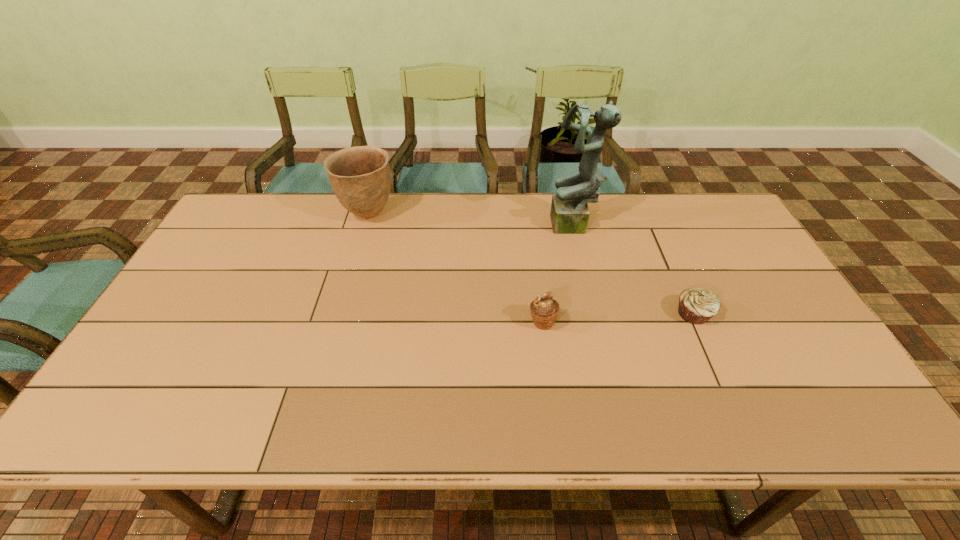
Locate an element on the screen. The width and height of the screenshot is (960, 540). free space between the shortest object and the left muffin is located at coordinates (618, 318).

Locate which object ranks second in proximity to the second object from left to right. Please provide its 2D coordinates. Your answer should be formatted as a tuple, i.e. [(x, y)], where the tuple contains the x and y coordinates of a point satisfying the conditions above.

[(696, 305)]

Locate which object ranks in proximity to the third object from left to right. Please provide its 2D coordinates. Your answer should be formatted as a tuple, i.e. [(x, y)], where the tuple contains the x and y coordinates of a point satisfying the conditions above.

[(696, 305)]

Locate an element on the screen. free space that satisfies the following two spatial constraints: 1. on the face of the shorter muffin; 2. on the left side of the sculpture is located at coordinates (594, 314).

The height and width of the screenshot is (540, 960). Find the location of `vacant space that satisfies the following two spatial constraints: 1. on the face of the sculpture; 2. on the front side of the second object from left to right`. vacant space that satisfies the following two spatial constraints: 1. on the face of the sculpture; 2. on the front side of the second object from left to right is located at coordinates (596, 322).